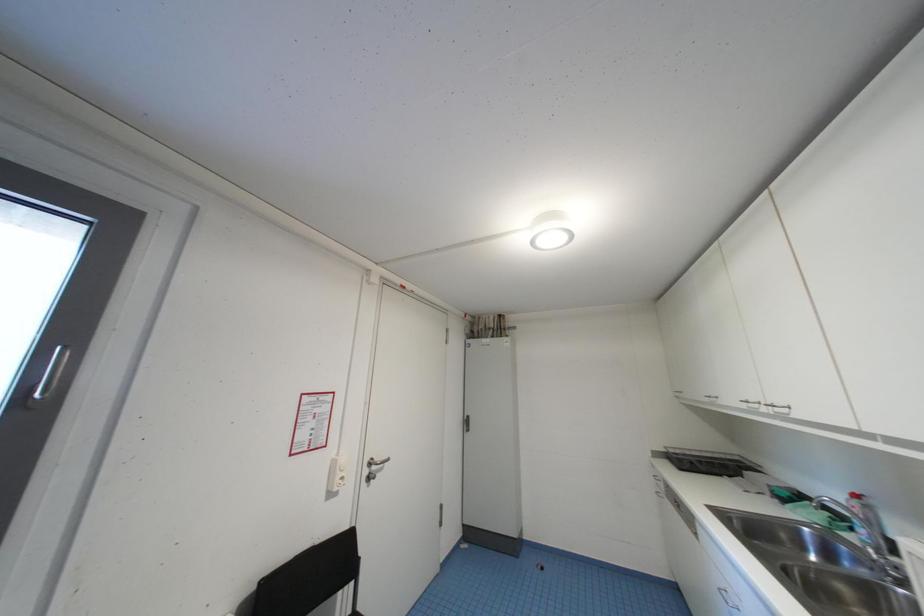
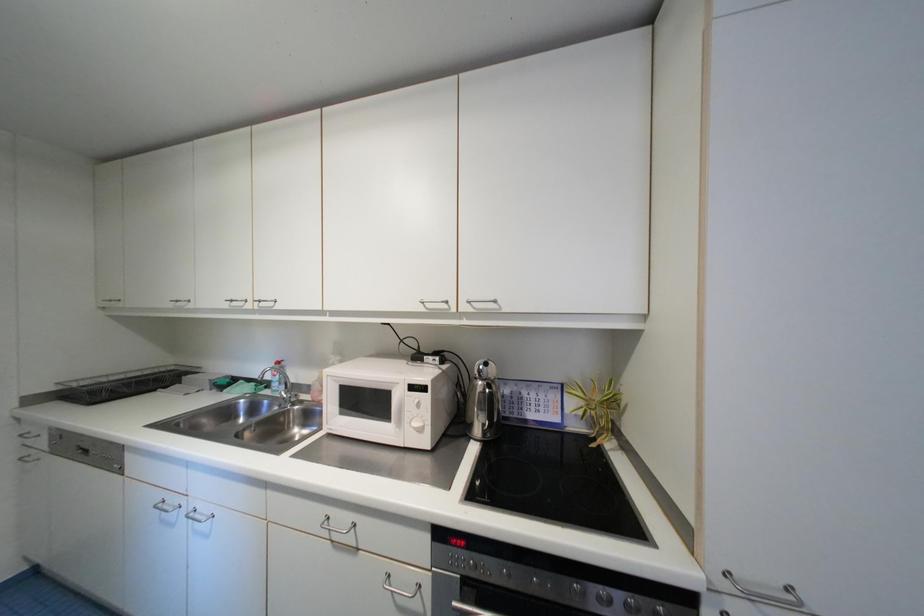
Question: The camera is either moving clockwise (left) or counter-clockwise (right) around the object. The first image is from the beginning of the video and the second image is from the end. Is the camera moving left or right when shooting the video?

Choices:
 (A) Left
 (B) Right

Answer: (A)